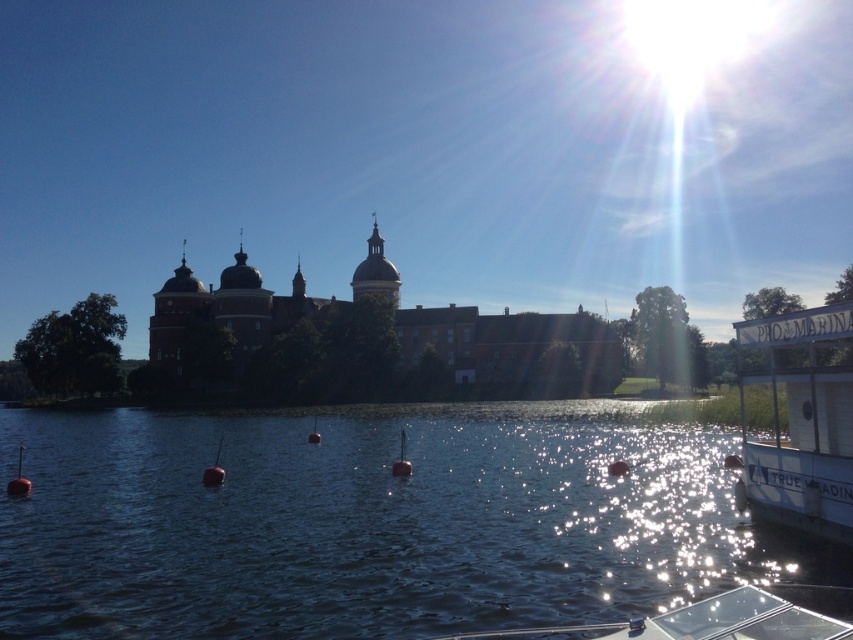
Question: Can you confirm if metallic silver buoy at center is positioned to the left of red buoy at lower left?

Choices:
 (A) yes
 (B) no

Answer: (B)

Question: In this image, where is dark blue water at center located relative to smooth red buoy at lower left?

Choices:
 (A) above
 (B) below

Answer: (B)

Question: Can you confirm if smooth red buoy at lower left is wider than metallic silver buoy at center?

Choices:
 (A) no
 (B) yes

Answer: (B)

Question: Considering the real-world distances, which object is farthest from the dark blue water at center?

Choices:
 (A) rubber buoy at lower left
 (B) red buoy at lower left
 (C) metallic silver buoy at center

Answer: (B)

Question: Among these points, which one is farthest from the camera?

Choices:
 (A) (x=202, y=474)
 (B) (x=397, y=472)
 (C) (x=311, y=432)

Answer: (C)

Question: Among these points, which one is farthest from the camera?

Choices:
 (A) (401, 429)
 (B) (206, 484)
 (C) (19, 451)

Answer: (A)